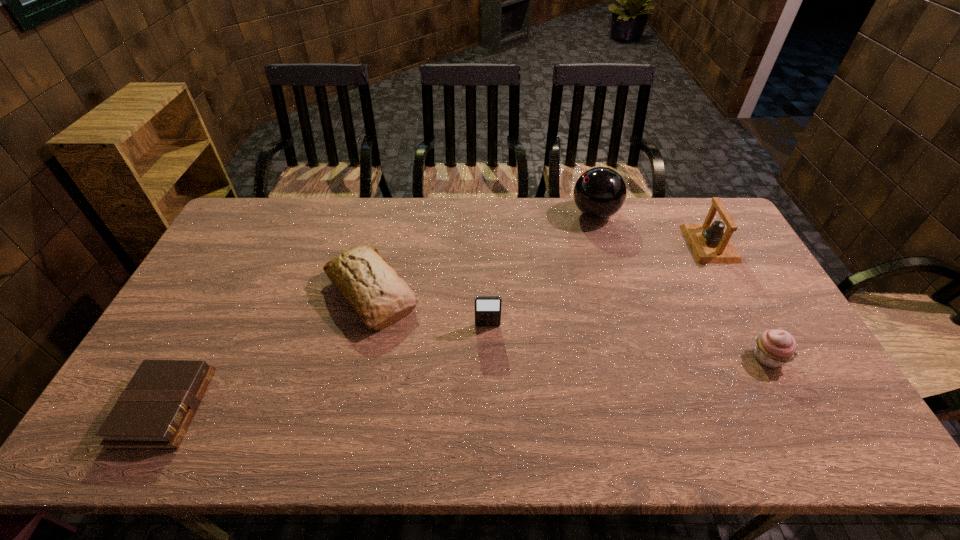
At what (x,y) coordinates should I click in order to perform the action: click on vacant space located on the surface of the third object from right to left near the finger holes. Please return your answer as a coordinate pair (x, y). Looking at the image, I should click on (468, 213).

At what (x,y) coordinates should I click in order to perform the action: click on free space located on the left of the bell. Please return your answer as a coordinate pair (x, y). Image resolution: width=960 pixels, height=540 pixels. Looking at the image, I should click on (641, 244).

Where is `free space located 0.240m on the front-facing side of the third object from left to right`? free space located 0.240m on the front-facing side of the third object from left to right is located at coordinates (489, 404).

Find the location of `free location located 0.080m on the back of the fifth object from right to left`. free location located 0.080m on the back of the fifth object from right to left is located at coordinates (384, 241).

Identify the location of free location located 0.300m on the left of the cupcake. This screenshot has width=960, height=540. (636, 357).

Find the location of a particular element. free region located on the spine side of the Bible is located at coordinates (276, 408).

Image resolution: width=960 pixels, height=540 pixels. I want to click on bowling ball present at the far edge, so click(x=600, y=192).

Locate an element on the screen. bell that is at the far edge is located at coordinates (710, 243).

Where is `object situated at the near edge`? Image resolution: width=960 pixels, height=540 pixels. object situated at the near edge is located at coordinates (153, 412).

Image resolution: width=960 pixels, height=540 pixels. What are the coordinates of `object at the left edge` in the screenshot? It's located at (153, 412).